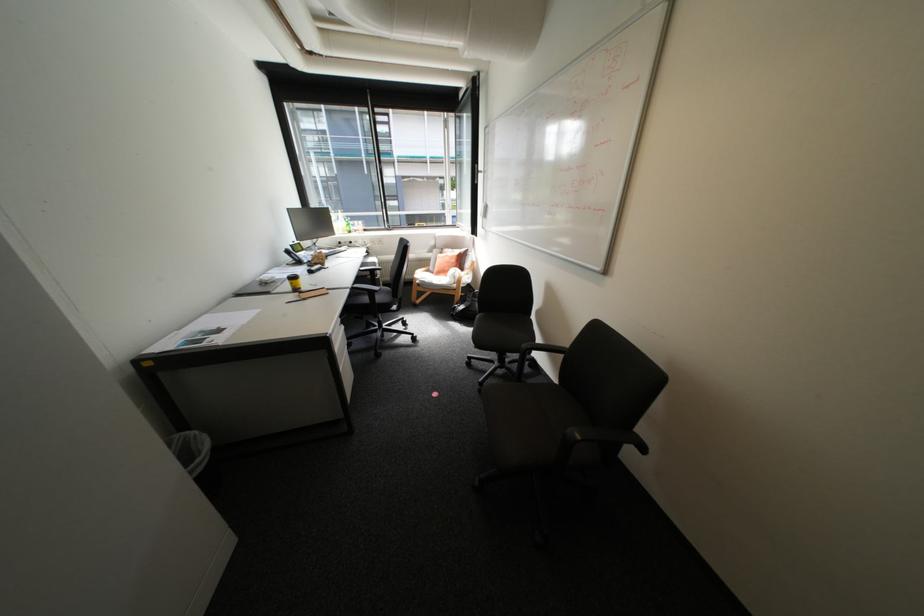
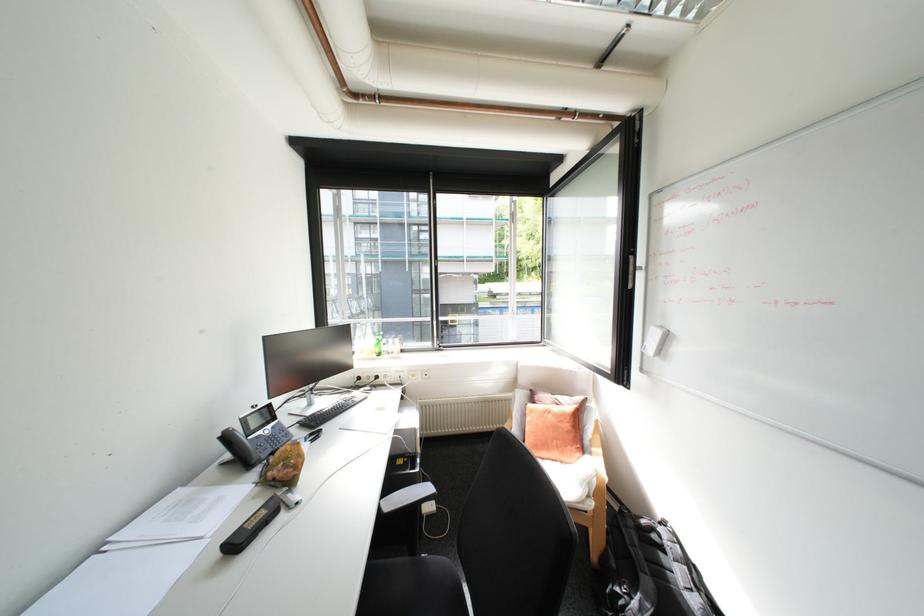
Question: I am providing you with two images of the same scene from different viewpoints. Which of the following objects are not visible in image2?

Choices:
 (A) orange pillow
 (B) black hole punch
 (C) window handle
 (D) none of these

Answer: (D)